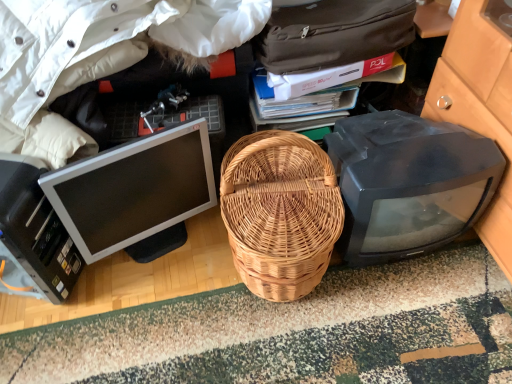
You are a GUI agent. You are given a task and a screenshot of the screen. Output one action in this format:
    pyautogui.click(x=<x>, y=<y>)
    Task: Click on the empty space that is in between matte black monitor at right, the first computer monitor when ordered from right to left, and natural wicker picnic basket at center
    The image size is (512, 384).
    Given the screenshot: What is the action you would take?
    pyautogui.click(x=390, y=279)